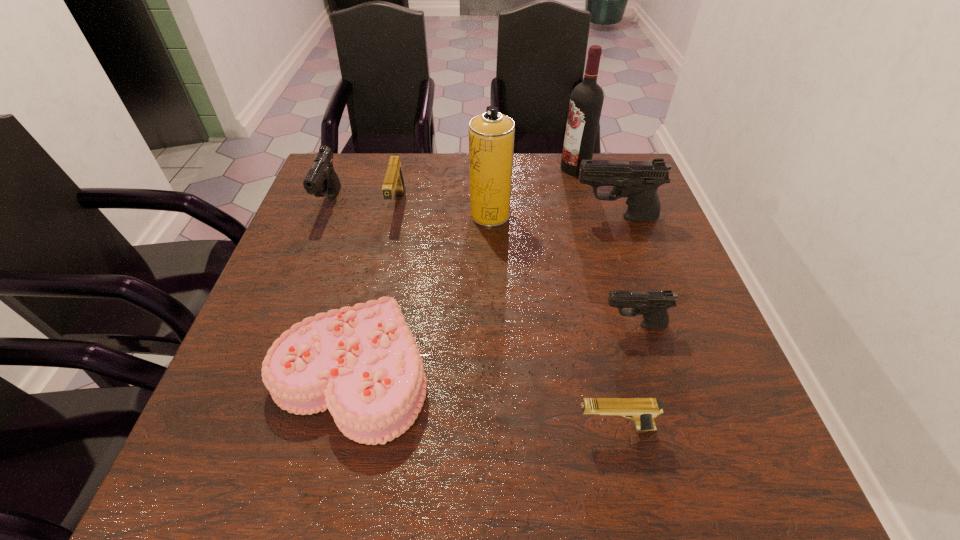
Find the location of a particular element. This screenshot has height=540, width=960. free region at the right edge of the desktop is located at coordinates (686, 319).

Image resolution: width=960 pixels, height=540 pixels. I want to click on free spot at the far left corner of the desktop, so click(322, 199).

Locate an element on the screen. This screenshot has height=540, width=960. vacant space at the near left corner of the desktop is located at coordinates (215, 478).

Where is `free space at the far right corner of the desktop`? free space at the far right corner of the desktop is located at coordinates (605, 155).

Where is `vacant space that's between the aerosol can and the leftmost object`? The width and height of the screenshot is (960, 540). vacant space that's between the aerosol can and the leftmost object is located at coordinates (410, 208).

At what (x,y) coordinates should I click in order to perform the action: click on vacant region between the wine bottle and the nearest black pistol. Please return your answer as a coordinate pair (x, y). Image resolution: width=960 pixels, height=540 pixels. Looking at the image, I should click on (605, 247).

Find the location of a particular element. The height and width of the screenshot is (540, 960). empty space that is in between the nearest pistol and the left tan pistol is located at coordinates (506, 316).

Image resolution: width=960 pixels, height=540 pixels. I want to click on free spot between the right tan pistol and the aerosol can, so click(552, 321).

Find the location of a particular element. The image size is (960, 540). vacant area that lies between the farther tan pistol and the shortest pistol is located at coordinates (506, 316).

I want to click on unoccupied position between the fourth farthest pistol and the smaller tan pistol, so click(624, 376).